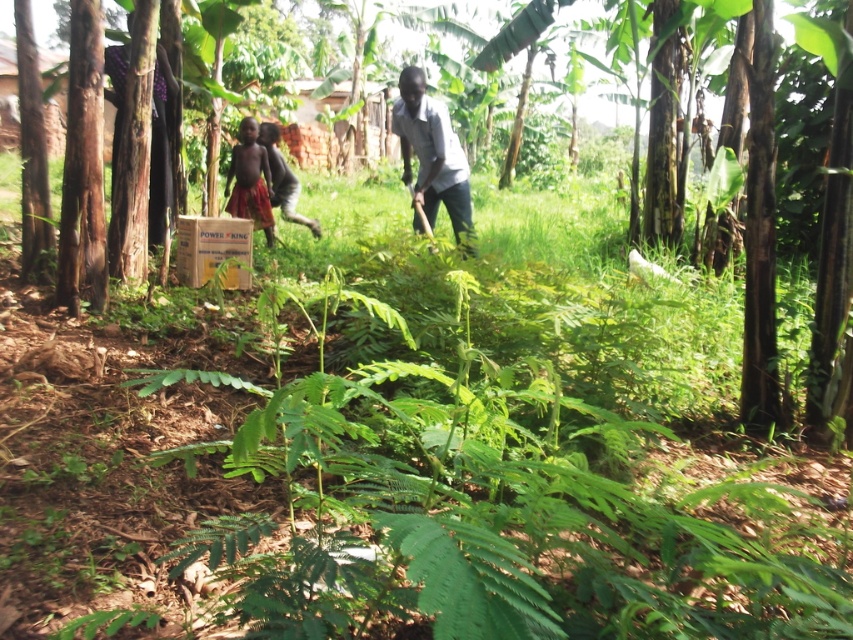
Is gray cotton shirt at center positioned in front of bare skin boy at center?

Yes, gray cotton shirt at center is closer to the viewer.

Between gray cotton shirt at center and bare skin boy at center, which one is positioned lower?

gray cotton shirt at center

Identify the location of gray cotton shirt at center. [x=431, y=152].

Which is behind, point (432, 164) or point (270, 189)?

The point (270, 189) is behind.

Does gray cotton shirt at center have a greater height compared to brown textured skirt at center?

No, gray cotton shirt at center is not taller than brown textured skirt at center.

This screenshot has width=853, height=640. What do you see at coordinates (431, 152) in the screenshot?
I see `gray cotton shirt at center` at bounding box center [431, 152].

At what (x,y) coordinates should I click in order to perform the action: click on gray cotton shirt at center. Please return your answer as a coordinate pair (x, y). Image resolution: width=853 pixels, height=640 pixels. Looking at the image, I should click on (431, 152).

Locate an element on the screen. The height and width of the screenshot is (640, 853). brown textured skirt at center is located at coordinates (250, 180).

Who is taller, brown textured skirt at center or bare skin boy at center?

With more height is brown textured skirt at center.

Is point (242, 120) farther from camera compared to point (273, 145)?

No, it is in front of (273, 145).

You are a GUI agent. You are given a task and a screenshot of the screen. Output one action in this format:
    pyautogui.click(x=<x>, y=<y>)
    Task: Click on the brown textured skirt at center
    
    Given the screenshot: What is the action you would take?
    pyautogui.click(x=250, y=180)